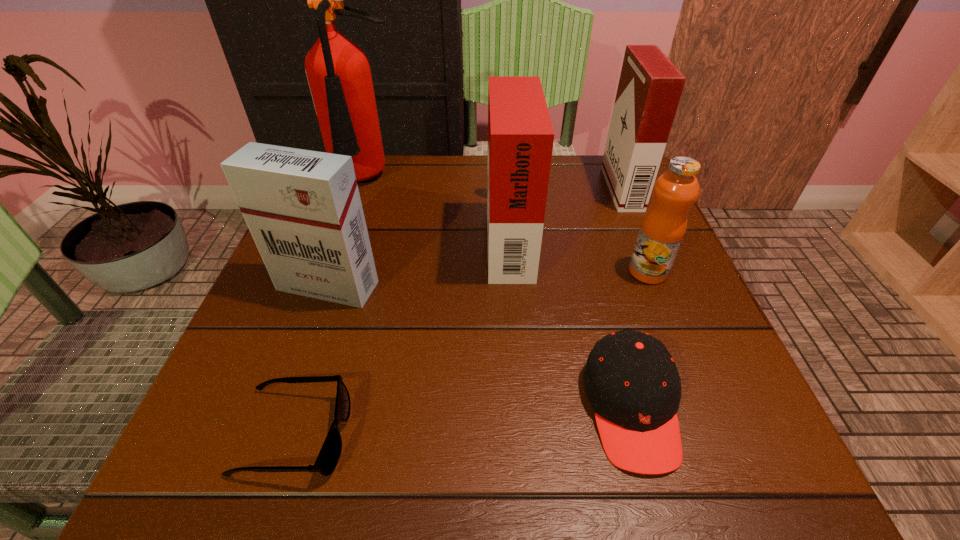
Find the location of a particular element. object located at the near right corner is located at coordinates (631, 380).

I want to click on free location at the far edge, so click(x=474, y=194).

The image size is (960, 540). In the image, there is a desktop. Identify the location of vacant space at the right edge. (702, 305).

Find the location of a particular element. This screenshot has height=540, width=960. free space at the near right corner of the desktop is located at coordinates (785, 494).

This screenshot has width=960, height=540. Find the location of `free space between the second shortest object and the rightmost cigarette case`. free space between the second shortest object and the rightmost cigarette case is located at coordinates (627, 298).

The image size is (960, 540). I want to click on vacant space that's between the shortest object and the cap, so click(463, 421).

What are the coordinates of `free space between the sixth tallest object and the fire extinguisher` in the screenshot? It's located at (499, 294).

The width and height of the screenshot is (960, 540). I want to click on free space between the fire extinguisher and the shortest object, so click(x=330, y=308).

At what (x,y) coordinates should I click in order to perform the action: click on vacant area between the shortest object and the fourth object from right to left. Please return your answer as a coordinate pair (x, y). The width and height of the screenshot is (960, 540). Looking at the image, I should click on (401, 335).

This screenshot has width=960, height=540. Identify the location of unoccupied position between the fire extinguisher and the shortest object. (330, 308).